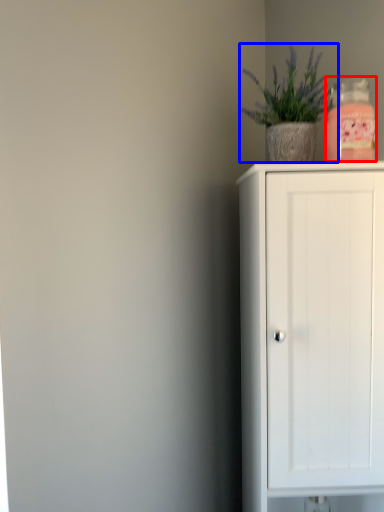
Question: Which of the following is the farthest to the observer, bottle (highlighted by a red box) or houseplant (highlighted by a blue box)?

Choices:
 (A) bottle
 (B) houseplant

Answer: (B)